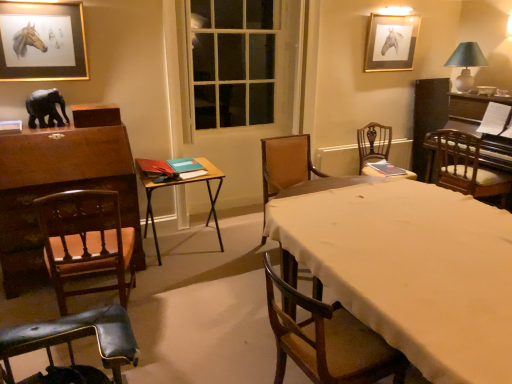
Question: In which direction should I rotate to look at white cloth-covered table at center, the first table viewed from the right?

Choices:
 (A) left
 (B) right

Answer: (B)

Question: Considering the relative sizes of brown wood chair at left, marked as the sixth chair in a right-to-left arrangement, and gold-framed painting of horse at upper left, positioned as the second picture frame in right-to-left order, in the image provided, is brown wood chair at left, marked as the sixth chair in a right-to-left arrangement, taller than gold-framed painting of horse at upper left, positioned as the second picture frame in right-to-left order,?

Choices:
 (A) no
 (B) yes

Answer: (B)

Question: Is brown wood chair at left, marked as the sixth chair in a right-to-left arrangement, smaller than gold-framed painting of horse at upper left, which appears as the 1th picture frame when viewed from the left?

Choices:
 (A) no
 (B) yes

Answer: (A)

Question: Does brown wood chair at left, marked as the sixth chair in a right-to-left arrangement, appear on the right side of gold-framed painting of horse at upper left, positioned as the second picture frame in right-to-left order?

Choices:
 (A) no
 (B) yes

Answer: (B)

Question: Is brown wood chair at left, the 1th chair viewed from the left, wider than gold-framed painting of horse at upper left, which is the second picture frame in back-to-front order?

Choices:
 (A) yes
 (B) no

Answer: (A)

Question: Would you say brown wood chair at left, marked as the sixth chair in a right-to-left arrangement, is a long distance from gold-framed painting of horse at upper left, acting as the first picture frame starting from the front?

Choices:
 (A) yes
 (B) no

Answer: (A)

Question: Can you confirm if brown wood chair at left, the 1th chair viewed from the left, is shorter than gold-framed painting of horse at upper left, which is the second picture frame in back-to-front order?

Choices:
 (A) yes
 (B) no

Answer: (B)

Question: Is wooden chair with cushion at right, the sixth chair viewed from the left, thinner than green fabric lampshade at upper right?

Choices:
 (A) yes
 (B) no

Answer: (B)

Question: From a real-world perspective, is wooden chair with cushion at right, which ranks as the first chair in right-to-left order, below green fabric lampshade at upper right?

Choices:
 (A) yes
 (B) no

Answer: (A)

Question: Does wooden chair with cushion at right, the sixth chair viewed from the left, have a smaller size compared to green fabric lampshade at upper right?

Choices:
 (A) no
 (B) yes

Answer: (A)

Question: Is wooden chair with cushion at right, which ranks as the first chair in right-to-left order, taller than green fabric lampshade at upper right?

Choices:
 (A) yes
 (B) no

Answer: (A)

Question: Can you confirm if wooden chair with cushion at right, the sixth chair viewed from the left, is bigger than green fabric lampshade at upper right?

Choices:
 (A) no
 (B) yes

Answer: (B)

Question: Is there a large distance between wooden chair with cushion at right, which ranks as the first chair in right-to-left order, and green fabric lampshade at upper right?

Choices:
 (A) no
 (B) yes

Answer: (A)

Question: Is gold-framed painting of horse at upper left, positioned as the second picture frame in right-to-left order, a part of gold-framed picture at upper right, which is the second picture frame in left-to-right order?

Choices:
 (A) yes
 (B) no

Answer: (B)